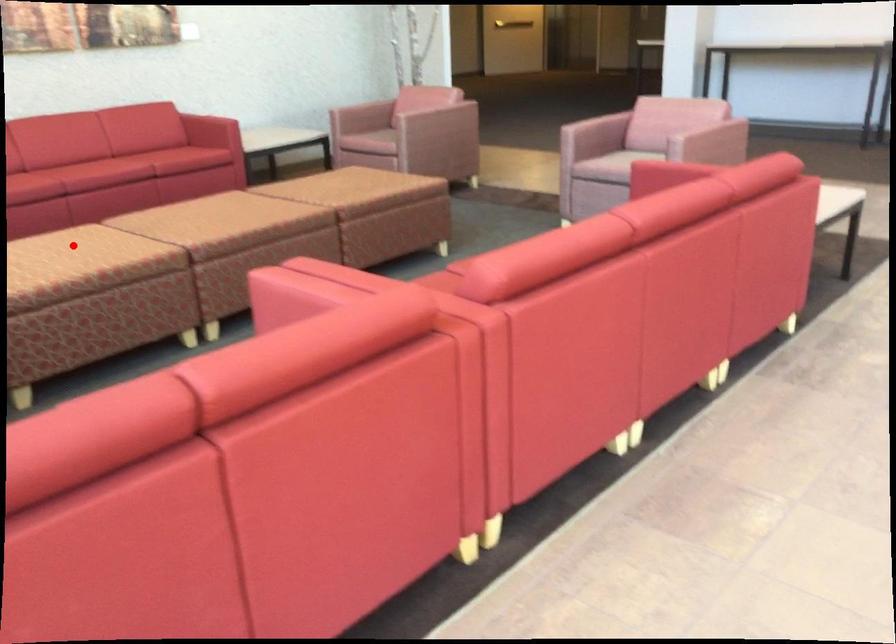
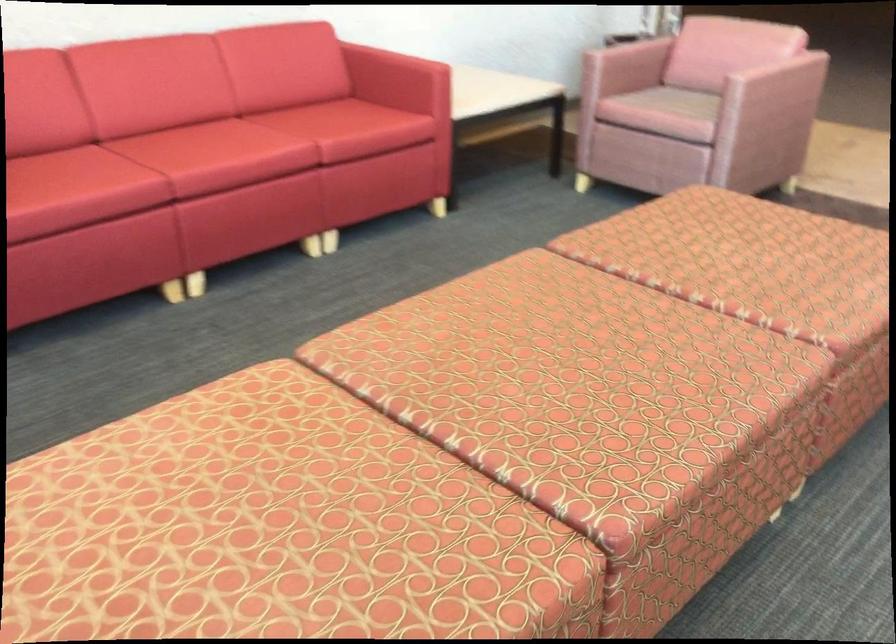
Question: I am providing you with two images of the same scene from different viewpoints. Image1 has a red point marked. In image2, the corresponding 3D location appears at what relative position? Reply with the corresponding letter.

Choices:
 (A) Closer
 (B) Farther

Answer: (A)